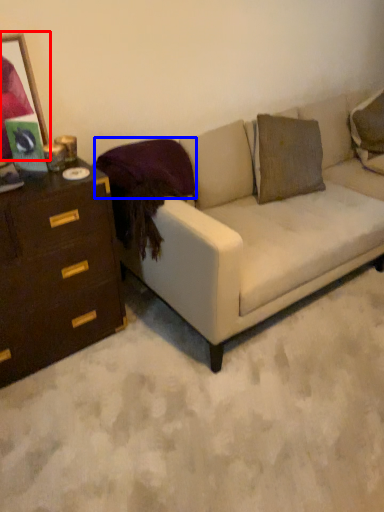
Question: Which object is further to the camera taking this photo, picture frame (highlighted by a red box) or pillow (highlighted by a blue box)?

Choices:
 (A) picture frame
 (B) pillow

Answer: (B)